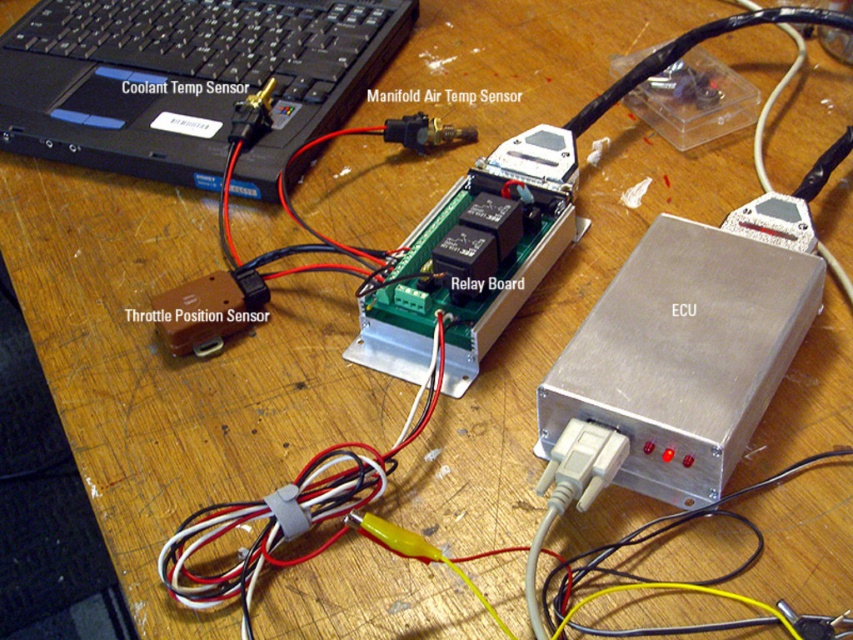
Is point (225, 76) less distant than point (677, 403)?

No, (225, 76) is further to viewer.

Who is more distant from viewer, (374,35) or (747,305)?

Positioned behind is point (374,35).

Locate an element on the screen. The width and height of the screenshot is (853, 640). black plastic laptop at upper left is located at coordinates (187, 81).